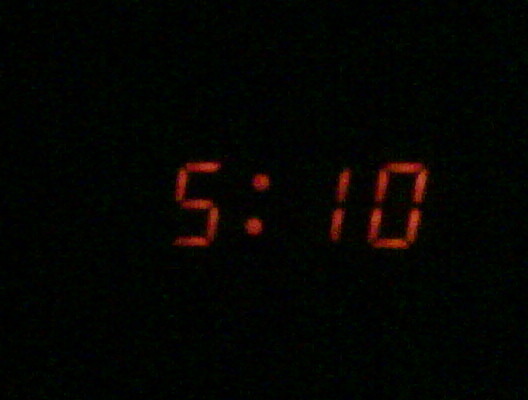
Identify the location of clock. The width and height of the screenshot is (528, 400). (256, 201).